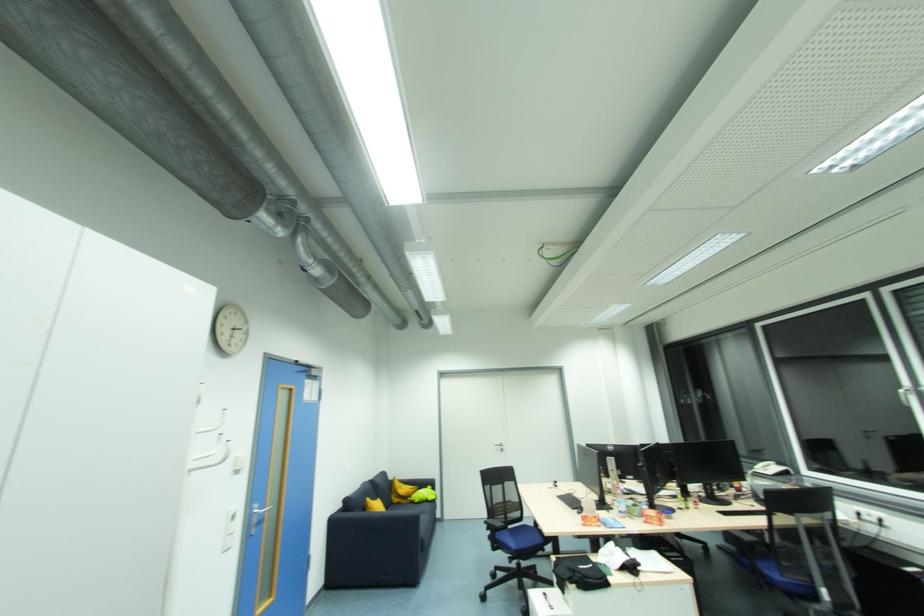
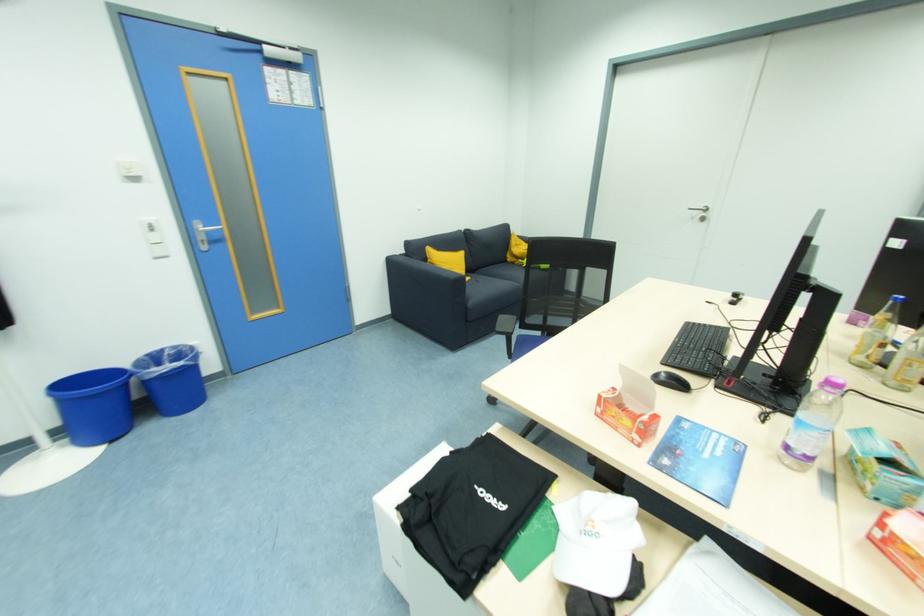
Where in the second image is the point corresponding to point (609, 567) from the first image?

(563, 535)